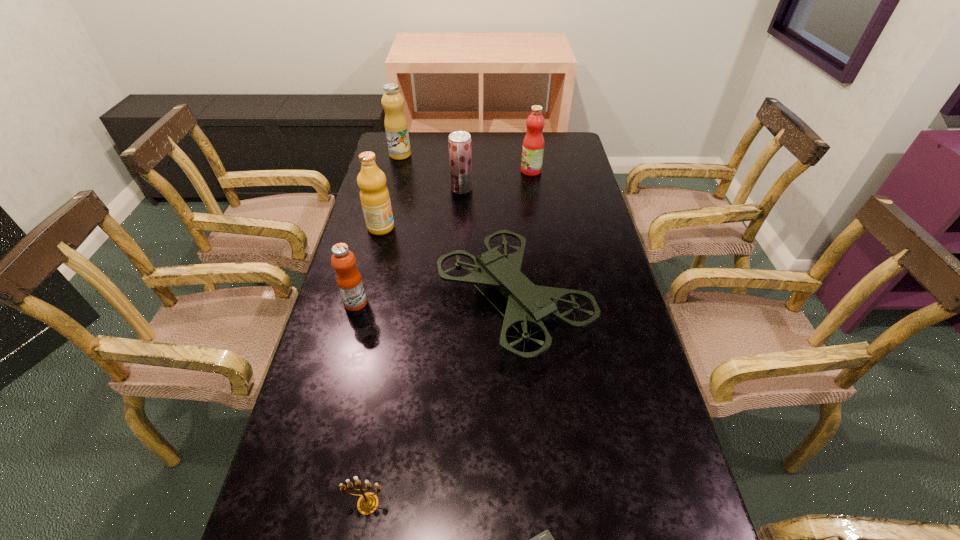
Where is `candelabrum situated at the left edge`? Image resolution: width=960 pixels, height=540 pixels. candelabrum situated at the left edge is located at coordinates (367, 504).

Locate an element on the screen. object located at the right edge is located at coordinates (527, 303).

Locate an element on the screen. object located in the far left corner section of the desktop is located at coordinates (396, 127).

Image resolution: width=960 pixels, height=540 pixels. Identify the location of blank space at the far edge of the desktop. (480, 139).

Find the location of `free region at the left edge of the desktop`. free region at the left edge of the desktop is located at coordinates (363, 249).

The height and width of the screenshot is (540, 960). Identify the location of free location at the right edge. (568, 299).

I want to click on blank region between the farthest fruit juice and the fifth object from right to left, so click(x=384, y=329).

The width and height of the screenshot is (960, 540). I want to click on vacant area between the farthest object and the candelabrum, so (x=384, y=329).

Where is `free area in between the second nearest fruit juice and the third nearest fruit juice`? The image size is (960, 540). free area in between the second nearest fruit juice and the third nearest fruit juice is located at coordinates (421, 208).

Where is `vacant area that lies between the fourth farthest object and the second nearest object`? vacant area that lies between the fourth farthest object and the second nearest object is located at coordinates (374, 366).